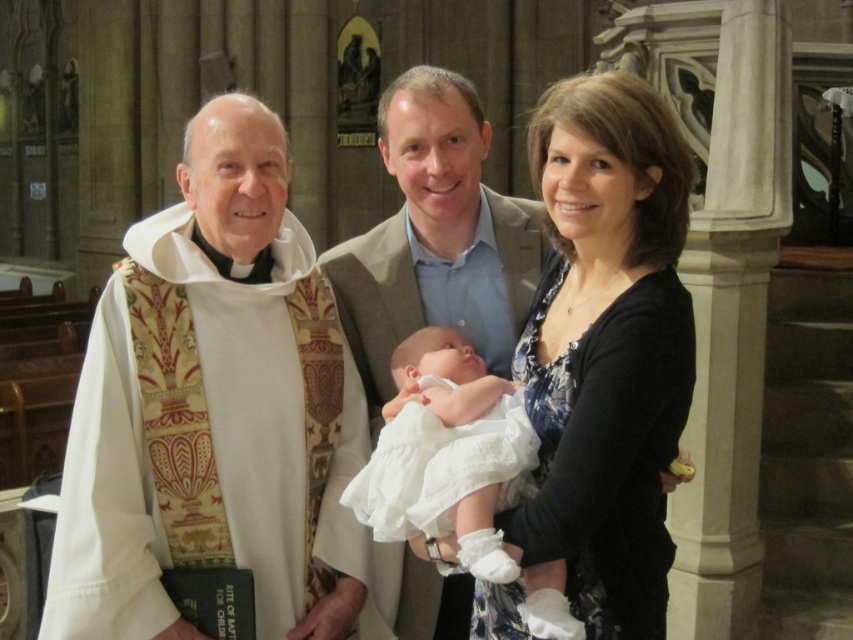
Question: Which of the following is the farthest from the observer?

Choices:
 (A) (641, 216)
 (B) (444, 128)

Answer: (B)

Question: Can you confirm if white silk vestment at left is positioned below white cotton dress at center?

Choices:
 (A) yes
 (B) no

Answer: (A)

Question: Does black floral dress at center appear on the right side of light brown textured suit at center?

Choices:
 (A) yes
 (B) no

Answer: (A)

Question: Which point is farther to the camera?

Choices:
 (A) (120, 483)
 (B) (511, 577)
 (C) (579, 579)
 (D) (434, 83)

Answer: (D)

Question: Is white silk vestment at left bigger than black floral dress at center?

Choices:
 (A) yes
 (B) no

Answer: (B)

Question: Which is nearer to the white cotton dress at center?

Choices:
 (A) light brown textured suit at center
 (B) white silk vestment at left
 (C) black floral dress at center

Answer: (C)